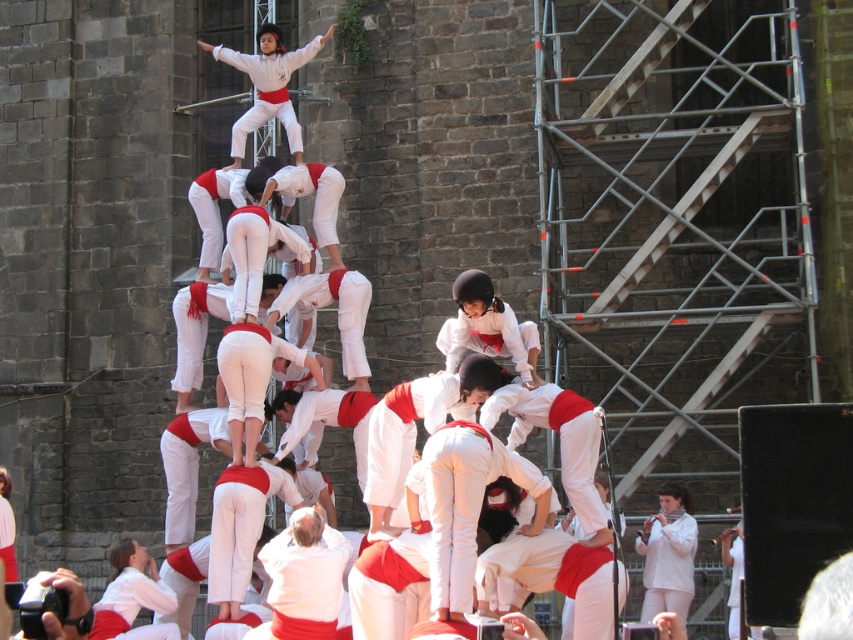
Question: Is white cotton shirt at center bigger than white matte/soft dancer at center?

Choices:
 (A) no
 (B) yes

Answer: (B)

Question: Which of the following is the farthest from the observer?

Choices:
 (A) white matte/soft dancer at center
 (B) white cotton shirt at center
 (C) white matte uniform at center

Answer: (C)

Question: Which object appears closest to the camera in this image?

Choices:
 (A) white matte/soft dancer at center
 (B) white matte uniform at center
 (C) white cotton shirt at center

Answer: (C)

Question: Which object is positioned closest to the white matte uniform at center?

Choices:
 (A) white matte/soft dancer at center
 (B) white cotton shirt at center

Answer: (A)

Question: Does white cotton shirt at center have a lesser width compared to white matte/soft dancer at center?

Choices:
 (A) no
 (B) yes

Answer: (A)

Question: Does white cotton shirt at center appear on the left side of white matte uniform at center?

Choices:
 (A) yes
 (B) no

Answer: (B)